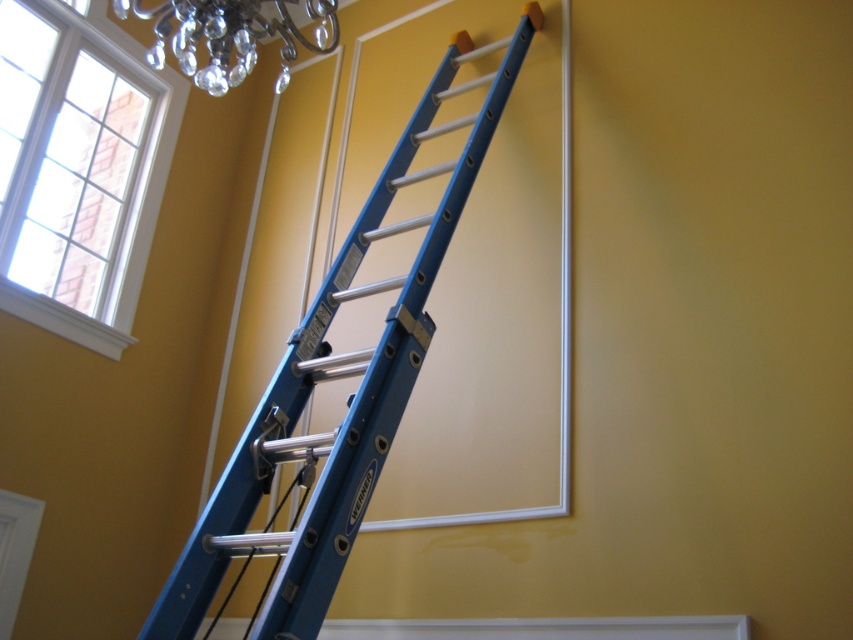
You are standing in the room and want to reach the point at coordinates point (383, 371). The ladder you have is 8 feet long. Can you safely reach the point using the ladder?

The point (383, 371) is 7.65 feet from the viewer. Since the ladder is 8 feet long, which is longer than the required distance, you can safely reach the point using the ladder.

Looking at this image, you are an interior designer planning to hang a large painting between the clear glass window at upper left and the crystal glass chandelier at upper left. Given that the painting requires at least 1.2 meters of vertical space, can you determine if there is enough vertical space between these two objects?

The clear glass window at upper left is much taller than the crystal glass chandelier at upper left, so there is sufficient vertical space between them to accommodate the painting requiring at least 1.2 meters.